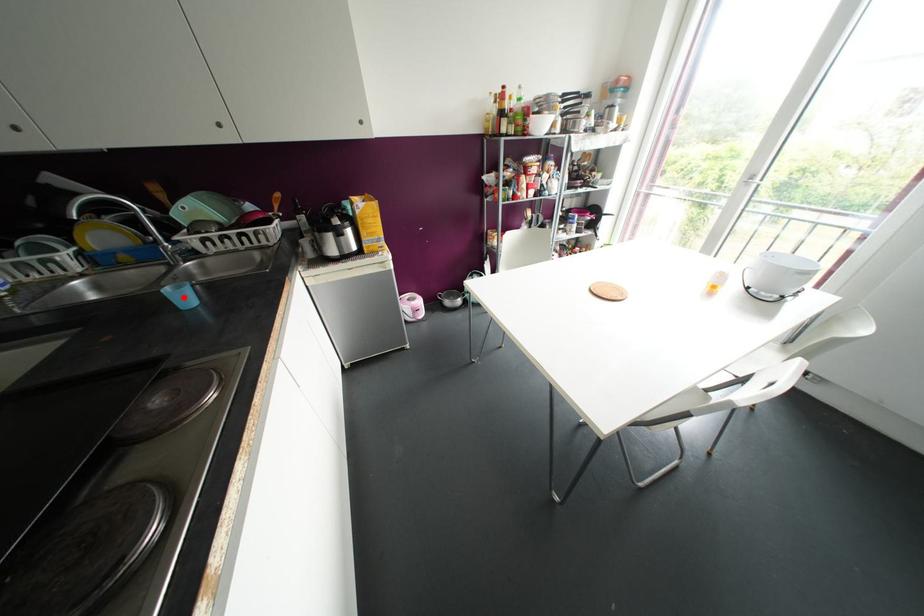
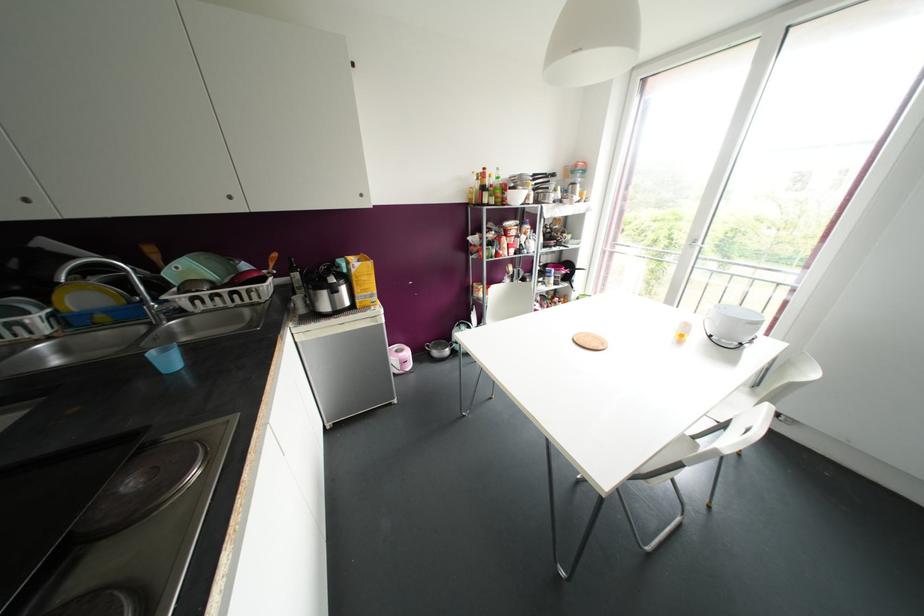
Question: I am providing you with two images of the same scene from different viewpoints. A red point is marked on the first image. Can you still see the location of the red point in image 2?

Choices:
 (A) Yes
 (B) No

Answer: (A)